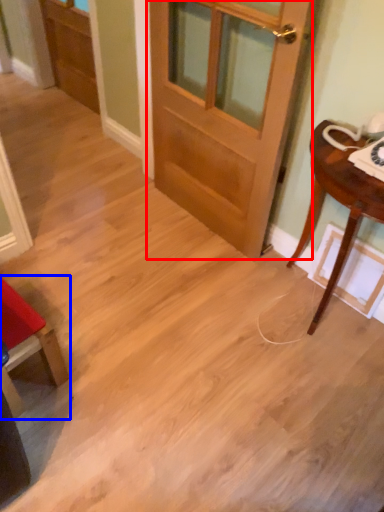
Question: Which point is closer to the camera, door (highlighted by a red box) or chair (highlighted by a blue box)?

Choices:
 (A) door
 (B) chair

Answer: (A)